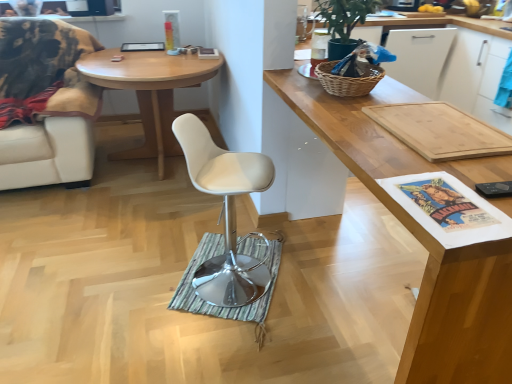
The image size is (512, 384). I want to click on free space to the right of green striped mat at center, so click(321, 281).